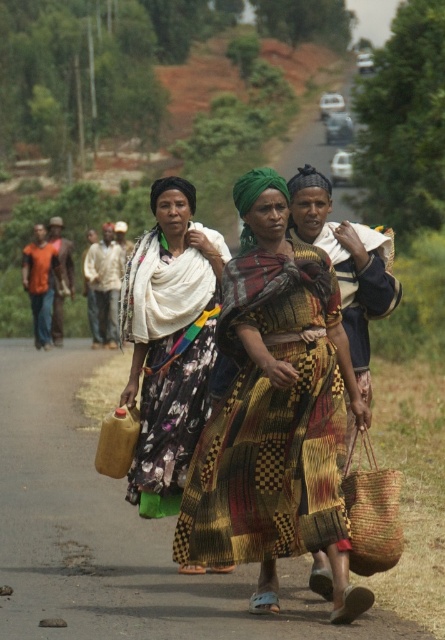
You are a photographer planning to take a group photo of the three women. You notice the multicolored woven dress at center and the floral fabric dress at center. Considering their widths, which dress will require more horizontal space in the frame to fully capture its details?

The multicolored woven dress at center requires more horizontal space in the frame because its width surpasses that of the floral fabric dress at center.

From the picture: Based on the scene description, where is the multicolored woven dress at center located in the image?

The multicolored woven dress at center is located at the 2D coordinates point (271, 422) in the image.

You are a photographer trying to capture the central woman in the scene. You notice the multicolored woven dress at center and the braided straw basket at center. Which object is smaller in size?

The multicolored woven dress at center is smaller in size compared to the braided straw basket at center.